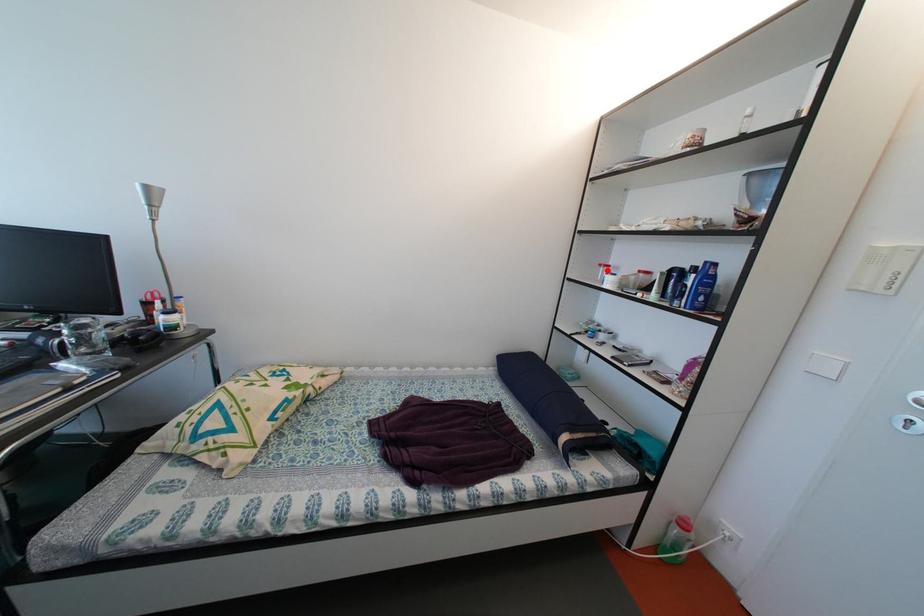
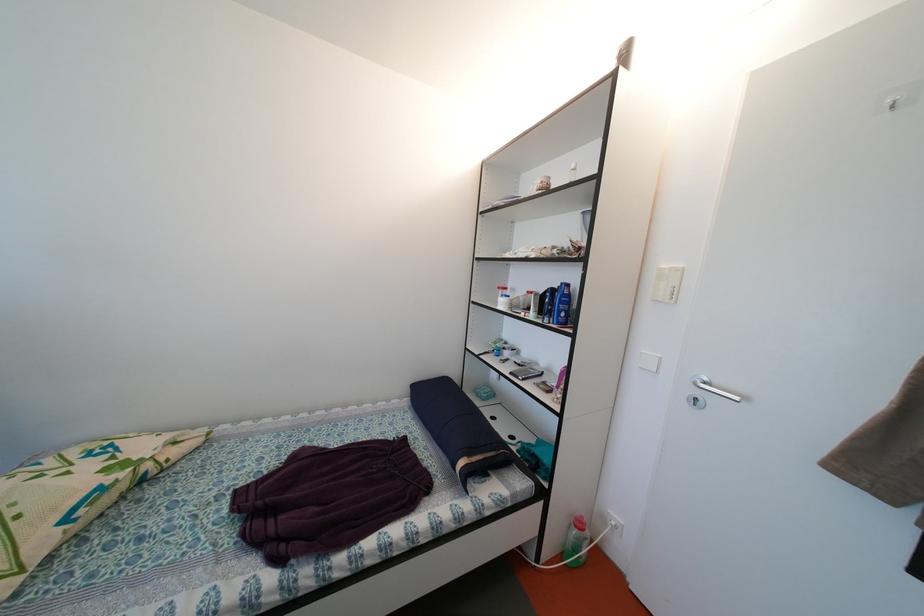
In the second image, find the point that corresponds to the highlighted location in the first image.

(505, 293)